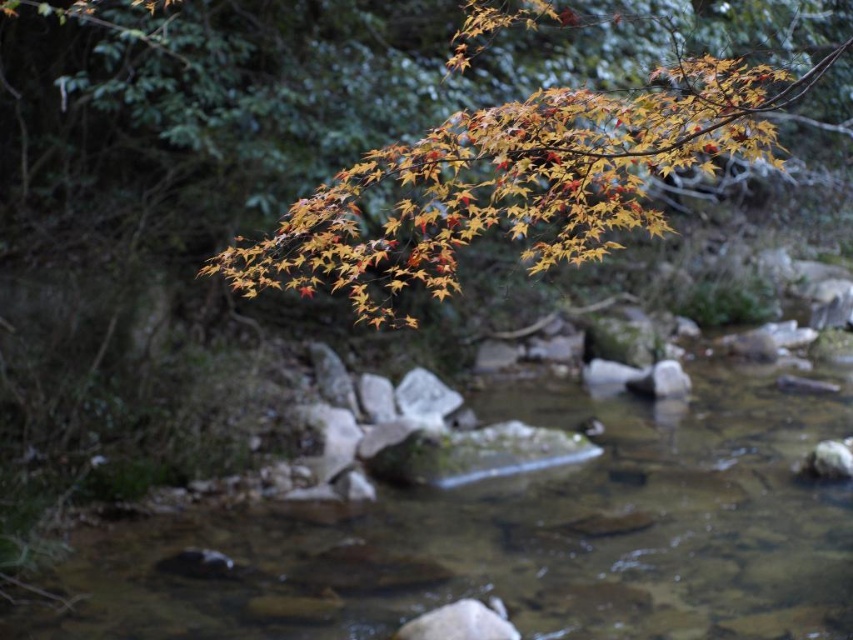
Question: Among these points, which one is farthest from the camera?

Choices:
 (A) (543, 109)
 (B) (358, 602)

Answer: (B)

Question: Is clear water stream at center wider than orange/yellow leaves at upper center?

Choices:
 (A) no
 (B) yes

Answer: (A)

Question: Which point is closer to the camera taking this photo?

Choices:
 (A) (596, 586)
 (B) (733, 92)

Answer: (B)

Question: Among these objects, which one is nearest to the camera?

Choices:
 (A) orange/yellow leaves at upper center
 (B) clear water stream at center

Answer: (A)

Question: Is clear water stream at center wider than orange/yellow leaves at upper center?

Choices:
 (A) no
 (B) yes

Answer: (A)

Question: Is clear water stream at center in front of orange/yellow leaves at upper center?

Choices:
 (A) yes
 (B) no

Answer: (B)